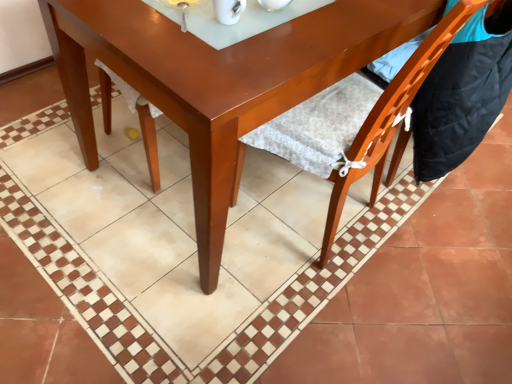
This screenshot has width=512, height=384. In order to click on vacant area that lies in front of wooden chair at lower right, arranged as the first chair when viewed from the left in this screenshot , I will do pyautogui.click(x=328, y=305).